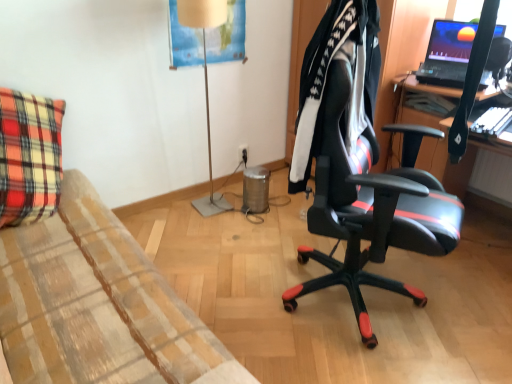
I want to click on matte black laptop at upper right, so click(x=447, y=53).

Where is `black plastic power outlet at center`? black plastic power outlet at center is located at coordinates (243, 153).

Locate an element on the screen. This screenshot has width=512, height=384. black leather office chair at center is located at coordinates (368, 209).

Is black leather office chair at center oriented towards black plastic power outlet at center?

No, black leather office chair at center is not oriented towards black plastic power outlet at center.

From the image's perspective, would you say black leather office chair at center is shown under black plastic power outlet at center?

Yes, from the image's perspective, black leather office chair at center is beneath black plastic power outlet at center.

From the picture: Considering the sizes of black leather office chair at center and black plastic power outlet at center in the image, is black leather office chair at center taller or shorter than black plastic power outlet at center?

Clearly, black leather office chair at center is taller compared to black plastic power outlet at center.

Is black leather jacket at center oriented away from black plastic power outlet at center?

No, black leather jacket at center's orientation is not away from black plastic power outlet at center.

Can you confirm if black leather jacket at center is taller than black plastic power outlet at center?

Yes.

Is black plastic power outlet at center inside black leather jacket at center?

No, black plastic power outlet at center is not surrounded by black leather jacket at center.

From the image's perspective, is black leather jacket at center over black plastic power outlet at center?

Yes.

Between black plastic power outlet at center and matte beige lamp at center, which one has less height?

Standing shorter between the two is black plastic power outlet at center.

Is black plastic power outlet at center positioned beyond the bounds of matte beige lamp at center?

Yes.

Are black plastic power outlet at center and matte beige lamp at center beside each other?

No.

Locate an element on the screen. lamp in front of the black plastic power outlet at center is located at coordinates (205, 82).

Considering the sizes of objects matte beige lamp at center and matte black laptop at upper right in the image provided, who is bigger, matte beige lamp at center or matte black laptop at upper right?

matte beige lamp at center is bigger.

From a real-world perspective, is matte beige lamp at center located beneath matte black laptop at upper right?

Yes.

Which is in front, point (209, 128) or point (447, 73)?

The point (447, 73) is more forward.

Considering the relative sizes of matte beige lamp at center and matte black laptop at upper right in the image provided, is matte beige lamp at center shorter than matte black laptop at upper right?

Incorrect, the height of matte beige lamp at center does not fall short of that of matte black laptop at upper right.

Which of these two, black leather jacket at center or black leather office chair at center, stands taller?

black leather office chair at center is taller.

From a real-world perspective, who is located higher, black leather jacket at center or black leather office chair at center?

black leather jacket at center, from a real-world perspective.

Is black leather jacket at center aimed at black leather office chair at center?

Yes, black leather jacket at center is aimed at black leather office chair at center.

Are black leather jacket at center and black leather office chair at center located far from each other?

black leather jacket at center is near black leather office chair at center, not far away.

Is black leather jacket at center bigger than matte black laptop at upper right?

Actually, black leather jacket at center might be smaller than matte black laptop at upper right.

From the image's perspective, which object appears higher, black leather jacket at center or matte black laptop at upper right?

From the image's view, matte black laptop at upper right is above.

From a real-world perspective, between black leather jacket at center and matte black laptop at upper right, who is vertically higher?

matte black laptop at upper right.

Can you see black plastic power outlet at center touching black leather jacket at center?

No, black plastic power outlet at center is not next to black leather jacket at center.

Does point (245, 145) appear closer or farther from the camera than point (328, 46)?

Point (245, 145) is farther from the camera than point (328, 46).

Relative to black leather jacket at center, is black plastic power outlet at center in front or behind?

Visually, black plastic power outlet at center is located behind black leather jacket at center.

Locate an element on the screen. This screenshot has height=384, width=512. chair in front of the black plastic power outlet at center is located at coordinates (368, 209).

This screenshot has height=384, width=512. In order to click on power outlet below the black leather jacket at center (from the image's perspective) in this screenshot , I will do `click(243, 153)`.

Which object lies nearer to the anchor point black leather jacket at center, black leather office chair at center or black plastic power outlet at center?

The object closer to black leather jacket at center is black leather office chair at center.

Looking at the image, which one is located closer to matte beige lamp at center, black plastic power outlet at center or black leather office chair at center?

black plastic power outlet at center.

When comparing their distances from matte beige lamp at center, does matte black laptop at upper right or black leather jacket at center seem closer?

black leather jacket at center lies closer to matte beige lamp at center than the other object.

From the image, which object appears to be farther from black leather jacket at center, matte beige lamp at center or black plastic power outlet at center?

black plastic power outlet at center is positioned further to the anchor black leather jacket at center.

Based on their spatial positions, is matte black laptop at upper right or black leather office chair at center closer to black plastic power outlet at center?

matte black laptop at upper right is closer to black plastic power outlet at center.

From the image, which object appears to be farther from black leather jacket at center, matte beige lamp at center or matte black laptop at upper right?

matte beige lamp at center is further to black leather jacket at center.

When comparing their distances from matte black laptop at upper right, does matte beige lamp at center or black leather jacket at center seem further?

matte beige lamp at center lies further to matte black laptop at upper right than the other object.

In the scene shown: Based on their spatial positions, is black leather jacket at center or black plastic power outlet at center closer to matte black laptop at upper right?

black leather jacket at center is positioned closer to the anchor matte black laptop at upper right.

In order to click on lamp between black leather office chair at center and black plastic power outlet at center along the z-axis in this screenshot , I will do `click(205, 82)`.

Find the location of a particular element. The width and height of the screenshot is (512, 384). clothing positioned between black leather office chair at center and black plastic power outlet at center from near to far is located at coordinates (327, 77).

Locate an element on the screen. Image resolution: width=512 pixels, height=384 pixels. clothing between black leather office chair at center and matte beige lamp at center in the front-back direction is located at coordinates (327, 77).

This screenshot has width=512, height=384. What are the coordinates of `lamp located between black leather jacket at center and black plastic power outlet at center in the depth direction` in the screenshot? It's located at (205, 82).